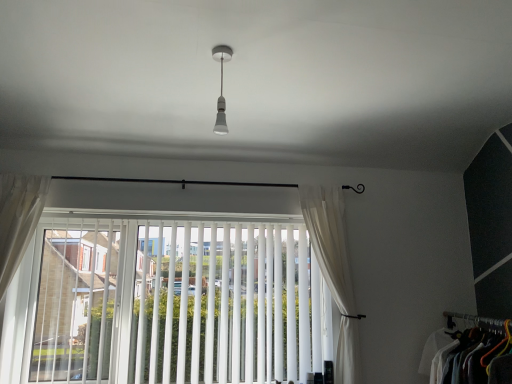
Where is `white vertical blinds at center`? This screenshot has width=512, height=384. white vertical blinds at center is located at coordinates pos(179,303).

What do you see at coordinates (471, 352) in the screenshot? I see `white fabric clothes at lower right` at bounding box center [471, 352].

At what (x,y) coordinates should I click in order to perform the action: click on white sheer curtain at right, which appears as the first curtain when viewed from the right. Please return your answer as a coordinate pair (x, y). Looking at the image, I should click on (334, 271).

Is white sheer curtain at left, acting as the first curtain starting from the left, oriented towards white fabric clothes at lower right?

No, white sheer curtain at left, acting as the first curtain starting from the left, is not aimed at white fabric clothes at lower right.

Is white sheer curtain at left, acting as the first curtain starting from the left, surrounding white fabric clothes at lower right?

That's incorrect, white fabric clothes at lower right is not inside white sheer curtain at left, acting as the first curtain starting from the left.

Between white sheer curtain at left, acting as the first curtain starting from the left, and white fabric clothes at lower right, which one is positioned behind?

white sheer curtain at left, acting as the first curtain starting from the left, is further from the camera.

Is white sheer curtain at left, acting as the first curtain starting from the left, bigger than white fabric clothes at lower right?

Actually, white sheer curtain at left, acting as the first curtain starting from the left, might be smaller than white fabric clothes at lower right.

Considering the relative sizes of white sheer curtain at right, which appears as the first curtain when viewed from the right, and white fabric clothes at lower right in the image provided, is white sheer curtain at right, which appears as the first curtain when viewed from the right, smaller than white fabric clothes at lower right?

Indeed, white sheer curtain at right, which appears as the first curtain when viewed from the right, has a smaller size compared to white fabric clothes at lower right.

Which point is more forward, (340, 266) or (492, 340)?

The point (492, 340) is closer.

Does white sheer curtain at right, which appears as the first curtain when viewed from the right, come behind white fabric clothes at lower right?

Yes, the depth of white sheer curtain at right, which appears as the first curtain when viewed from the right, is greater than that of white fabric clothes at lower right.

Measure the distance from white sheer curtain at right, which appears as the first curtain when viewed from the right, to white fabric clothes at lower right.

A distance of 25.52 inches exists between white sheer curtain at right, which appears as the first curtain when viewed from the right, and white fabric clothes at lower right.

Considering the relative positions of white sheer curtain at right, arranged as the second curtain when viewed from the left, and matte white light bulb at center in the image provided, is white sheer curtain at right, arranged as the second curtain when viewed from the left, to the left of matte white light bulb at center from the viewer's perspective?

No, white sheer curtain at right, arranged as the second curtain when viewed from the left, is not to the left of matte white light bulb at center.

Is white sheer curtain at right, arranged as the second curtain when viewed from the left, spatially inside matte white light bulb at center, or outside of it?

white sheer curtain at right, arranged as the second curtain when viewed from the left, is outside matte white light bulb at center.

Is white sheer curtain at right, which appears as the first curtain when viewed from the right, not near matte white light bulb at center?

Indeed, white sheer curtain at right, which appears as the first curtain when viewed from the right, is not near matte white light bulb at center.

Between matte white light bulb at center and white fabric clothes at lower right, which one appears on the right side from the viewer's perspective?

white fabric clothes at lower right is more to the right.

Choose the correct answer: Is matte white light bulb at center inside white fabric clothes at lower right or outside it?

matte white light bulb at center is outside white fabric clothes at lower right.

At what (x,y) coordinates should I click in order to perform the action: click on closet that is on the right side of matte white light bulb at center. Please return your answer as a coordinate pair (x, y). Looking at the image, I should click on (471, 352).

From a real-world perspective, is matte white light bulb at center above or below white fabric clothes at lower right?

In terms of real-world spatial position, matte white light bulb at center is above white fabric clothes at lower right.

Based on the photo, could you tell me if white fabric clothes at lower right is facing white sheer curtain at left, which is the second curtain from right to left?

Yes, white fabric clothes at lower right is turned towards white sheer curtain at left, which is the second curtain from right to left.

How far apart are white fabric clothes at lower right and white sheer curtain at left, acting as the first curtain starting from the left?

white fabric clothes at lower right is 2.37 meters from white sheer curtain at left, acting as the first curtain starting from the left.

Between white fabric clothes at lower right and white sheer curtain at left, which is the second curtain from right to left, which one is positioned in front?

Positioned in front is white fabric clothes at lower right.

Based on their sizes in the image, would you say white vertical blinds at center is bigger or smaller than white sheer curtain at right, arranged as the second curtain when viewed from the left?

white vertical blinds at center is bigger than white sheer curtain at right, arranged as the second curtain when viewed from the left.

Does white vertical blinds at center have a greater width compared to white sheer curtain at right, which appears as the first curtain when viewed from the right?

No.

Visually, is white vertical blinds at center positioned to the left or to the right of white sheer curtain at right, arranged as the second curtain when viewed from the left?

From the image, it's evident that white vertical blinds at center is to the left of white sheer curtain at right, arranged as the second curtain when viewed from the left.

How distant is white vertical blinds at center from white sheer curtain at right, arranged as the second curtain when viewed from the left?

white vertical blinds at center is 25.89 inches away from white sheer curtain at right, arranged as the second curtain when viewed from the left.

Considering the sizes of white sheer curtain at left, acting as the first curtain starting from the left, and white vertical blinds at center in the image, is white sheer curtain at left, acting as the first curtain starting from the left, bigger or smaller than white vertical blinds at center?

Clearly, white sheer curtain at left, acting as the first curtain starting from the left, is smaller in size than white vertical blinds at center.

Which point is more forward, (x=4, y=283) or (x=165, y=371)?

Point (x=4, y=283)

The height and width of the screenshot is (384, 512). There is a white vertical blinds at center. In order to click on the 2nd curtain above it (from a real-world perspective) in this screenshot , I will do `click(18, 219)`.

Is white sheer curtain at left, which is the second curtain from right to left, at the left side of white vertical blinds at center?

Answer: Yes.

The height and width of the screenshot is (384, 512). Identify the location of curtain that is the 2nd object to the left of the white fabric clothes at lower right, starting at the anchor. (18, 219).

You are a GUI agent. You are given a task and a screenshot of the screen. Output one action in this format:
    pyautogui.click(x=<x>, y=<y>)
    Task: Click on the closet beneath the white sheer curtain at right, which appears as the first curtain when viewed from the right (from a real-world perspective)
    
    Given the screenshot: What is the action you would take?
    pyautogui.click(x=471, y=352)

Looking at the image, which one is located closer to matte white light bulb at center, white sheer curtain at left, which is the second curtain from right to left, or white fabric clothes at lower right?

Based on the image, white sheer curtain at left, which is the second curtain from right to left, appears to be nearer to matte white light bulb at center.

Estimate the real-world distances between objects in this image. Which object is closer to white sheer curtain at left, acting as the first curtain starting from the left, white fabric clothes at lower right or matte white light bulb at center?

Based on the image, matte white light bulb at center appears to be nearer to white sheer curtain at left, acting as the first curtain starting from the left.

Which object lies nearer to the anchor point white fabric clothes at lower right, matte white light bulb at center or white sheer curtain at left, acting as the first curtain starting from the left?

matte white light bulb at center is positioned closer to the anchor white fabric clothes at lower right.

From the image, which object appears to be farther from white vertical blinds at center, white sheer curtain at left, acting as the first curtain starting from the left, or matte white light bulb at center?

Among the two, matte white light bulb at center is located further to white vertical blinds at center.

Consider the image. Which object lies further to the anchor point white vertical blinds at center, white sheer curtain at left, acting as the first curtain starting from the left, or white fabric clothes at lower right?

white fabric clothes at lower right.

When comparing their distances from white fabric clothes at lower right, does matte white light bulb at center or white sheer curtain at right, which appears as the first curtain when viewed from the right, seem further?

Among the two, matte white light bulb at center is located further to white fabric clothes at lower right.

Looking at the image, which one is located closer to matte white light bulb at center, white sheer curtain at left, which is the second curtain from right to left, or white vertical blinds at center?

Based on the image, white vertical blinds at center appears to be nearer to matte white light bulb at center.

Based on their spatial positions, is white fabric clothes at lower right or white sheer curtain at left, acting as the first curtain starting from the left, closer to white vertical blinds at center?

Among the two, white sheer curtain at left, acting as the first curtain starting from the left, is located nearer to white vertical blinds at center.

Where is `light fixture located between white sheer curtain at left, acting as the first curtain starting from the left, and white fabric clothes at lower right in the left-right direction`? The width and height of the screenshot is (512, 384). light fixture located between white sheer curtain at left, acting as the first curtain starting from the left, and white fabric clothes at lower right in the left-right direction is located at coordinates (221, 88).

Locate an element on the screen. window between white sheer curtain at left, which is the second curtain from right to left, and white fabric clothes at lower right, in the horizontal direction is located at coordinates (179, 303).

Where is `light fixture between white vertical blinds at center and white fabric clothes at lower right in the horizontal direction`? light fixture between white vertical blinds at center and white fabric clothes at lower right in the horizontal direction is located at coordinates (221, 88).

Locate an element on the screen. curtain situated between white sheer curtain at left, which is the second curtain from right to left, and white fabric clothes at lower right from left to right is located at coordinates (334, 271).